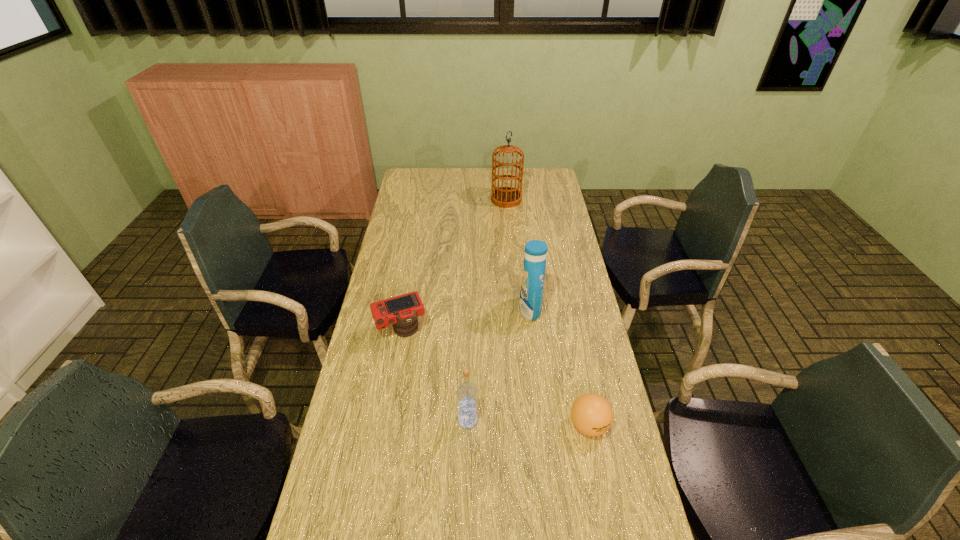
Identify the location of vacant point located between the fourth shortest object and the second object from left to right. The image size is (960, 540). (499, 365).

Where is `object that is the third closest to the leftmost object`? The height and width of the screenshot is (540, 960). object that is the third closest to the leftmost object is located at coordinates (591, 414).

Point out which object is positioned as the third nearest to the leftmost object. Please provide its 2D coordinates. Your answer should be formatted as a tuple, i.e. [(x, y)], where the tuple contains the x and y coordinates of a point satisfying the conditions above.

[(591, 414)]